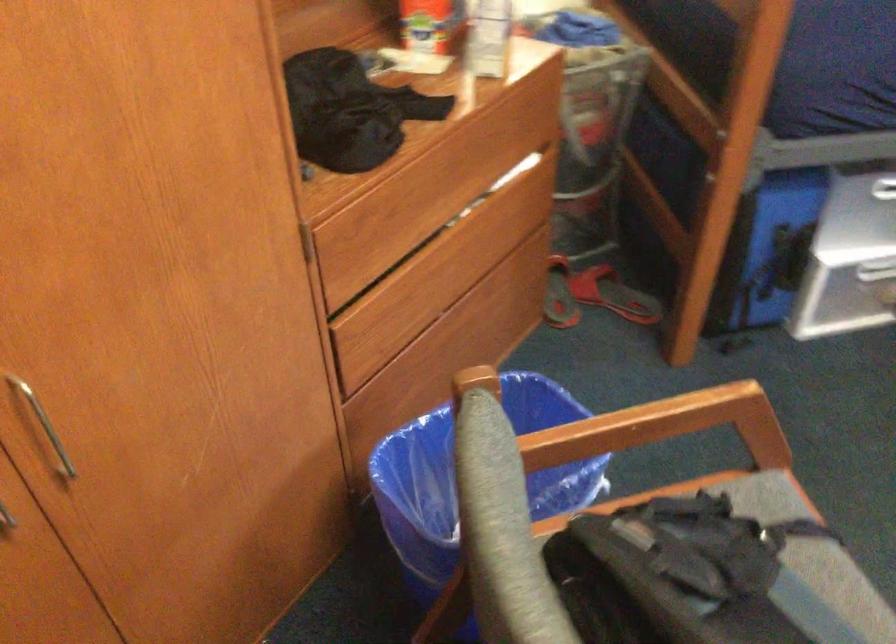
At what (x,y) coordinates should I click in order to perform the action: click on wooden chair armrest. Please return your answer as a coordinate pair (x, y). This screenshot has width=896, height=644. Looking at the image, I should click on (672, 421).